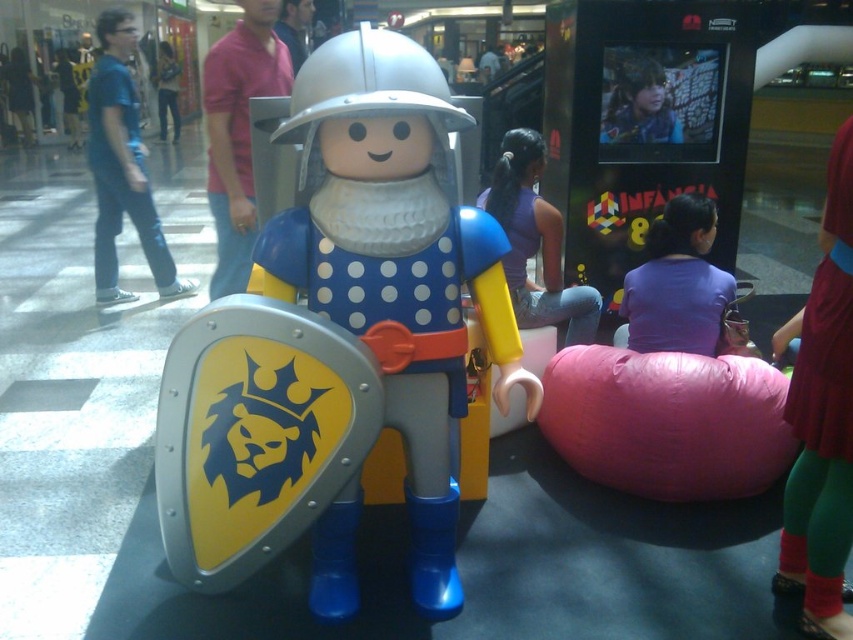
Which is above, matte plastic toy at center or white matte helmet at center?

white matte helmet at center is above.

Consider the image. Is matte plastic toy at center shorter than white matte helmet at center?

No.

Locate an element on the screen. matte plastic toy at center is located at coordinates (397, 266).

Which is in front, point (439, 113) or point (178, 124)?

Point (439, 113) is more forward.

Does point (312, 113) come behind point (177, 134)?

That is False.

What do you see at coordinates (373, 93) in the screenshot? The image size is (853, 640). I see `white matte helmet at center` at bounding box center [373, 93].

Where is `white matte helmet at center`? The image size is (853, 640). white matte helmet at center is located at coordinates (373, 93).

Does matte plastic toy at center appear under brushed metal helmet at upper center?

Yes, matte plastic toy at center is below brushed metal helmet at upper center.

Locate an element on the screen. This screenshot has width=853, height=640. matte plastic toy at center is located at coordinates (397, 266).

This screenshot has height=640, width=853. What do you see at coordinates (397, 266) in the screenshot? I see `matte plastic toy at center` at bounding box center [397, 266].

Image resolution: width=853 pixels, height=640 pixels. I want to click on matte plastic toy at center, so click(397, 266).